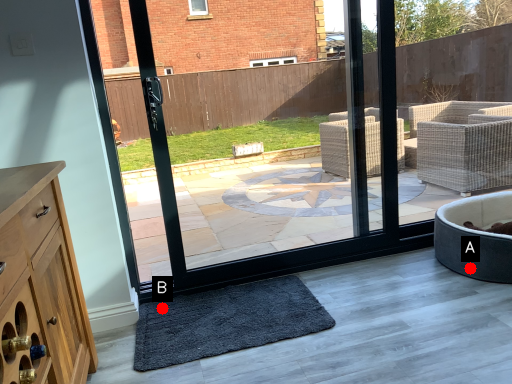
Question: Two points are circled on the image, labeled by A and B beside each circle. Which point is closer to the camera taking this photo?

Choices:
 (A) A is closer
 (B) B is closer

Answer: (B)